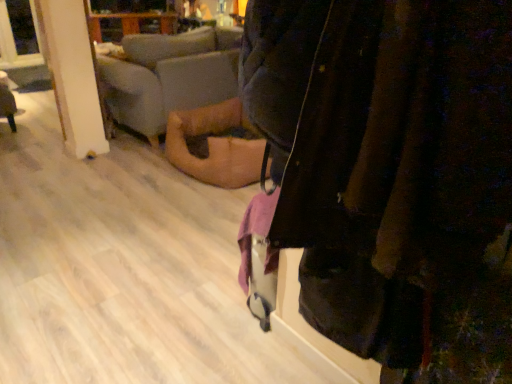
Question: Is wooden floor at lower left aimed at velvet dark jacket at center?

Choices:
 (A) no
 (B) yes

Answer: (A)

Question: Is wooden floor at lower left smaller than velvet dark jacket at center?

Choices:
 (A) yes
 (B) no

Answer: (A)

Question: Does wooden floor at lower left appear on the left side of velvet dark jacket at center?

Choices:
 (A) no
 (B) yes

Answer: (B)

Question: Is wooden floor at lower left looking in the opposite direction of velvet dark jacket at center?

Choices:
 (A) no
 (B) yes

Answer: (A)

Question: From a real-world perspective, is wooden floor at lower left positioned over velvet dark jacket at center based on gravity?

Choices:
 (A) yes
 (B) no

Answer: (B)

Question: Are wooden floor at lower left and velvet dark jacket at center beside each other?

Choices:
 (A) yes
 (B) no

Answer: (B)

Question: Is soft beige fabric couch at center positioned behind velvet dark jacket at center?

Choices:
 (A) no
 (B) yes

Answer: (B)

Question: Can you confirm if soft beige fabric couch at center is taller than velvet dark jacket at center?

Choices:
 (A) no
 (B) yes

Answer: (B)

Question: Considering the relative positions of soft beige fabric couch at center and velvet dark jacket at center in the image provided, is soft beige fabric couch at center to the right of velvet dark jacket at center from the viewer's perspective?

Choices:
 (A) no
 (B) yes

Answer: (A)

Question: Can velvet dark jacket at center be found inside soft beige fabric couch at center?

Choices:
 (A) yes
 (B) no

Answer: (B)

Question: Is soft beige fabric couch at center located outside velvet dark jacket at center?

Choices:
 (A) no
 (B) yes

Answer: (B)

Question: From a real-world perspective, is soft beige fabric couch at center on velvet dark jacket at center?

Choices:
 (A) no
 (B) yes

Answer: (A)

Question: From the image's perspective, is velvet dark jacket at center over soft beige fabric couch at center?

Choices:
 (A) no
 (B) yes

Answer: (A)